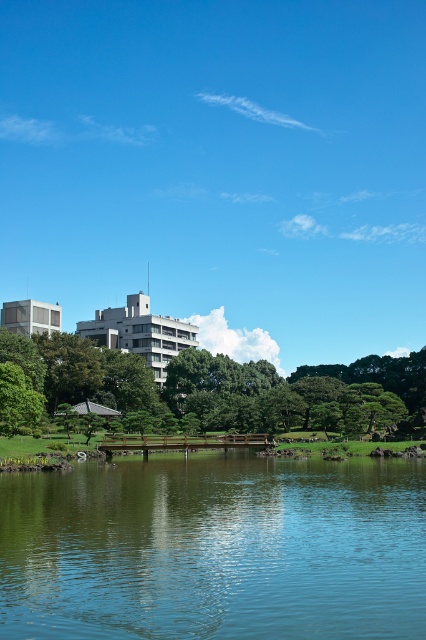
You are standing in the garden and want to take a photo of both the transparent glass water at center and the green leafy tree at center. Which object will appear larger in the photo?

The transparent glass water at center will appear larger in the photo because it is closer to the viewer than the green leafy tree at center.

You are a landscape architect designing a new garden. You have to place a small statue exactly between the transparent glass water at center and the green leafy tree at center. Which object will the statue be closer to?

The statue will be closer to the transparent glass water at center because it has a smaller size compared to the green leafy tree at center, so the distance between them would mean the midpoint is nearer to the smaller object.

You are a photographer standing at the wooden bridge in the image. You want to capture a photo that includes both the transparent glass water at center and the green leafy tree at center. Which object should you adjust your camera angle to focus on first to ensure both are in frame?

You should focus on the transparent glass water at center first since it is positioned on the left side of the green leafy tree at center, so adjusting the angle to include the left side ensures both objects are captured.